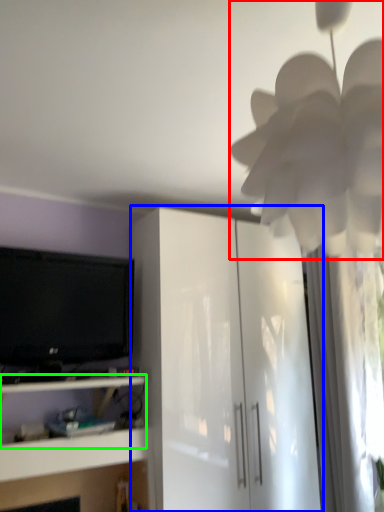
Question: Which is farther away from flower (highlighted by a red box)? cabinetry (highlighted by a blue box) or shelf (highlighted by a green box)?

Choices:
 (A) cabinetry
 (B) shelf

Answer: (B)